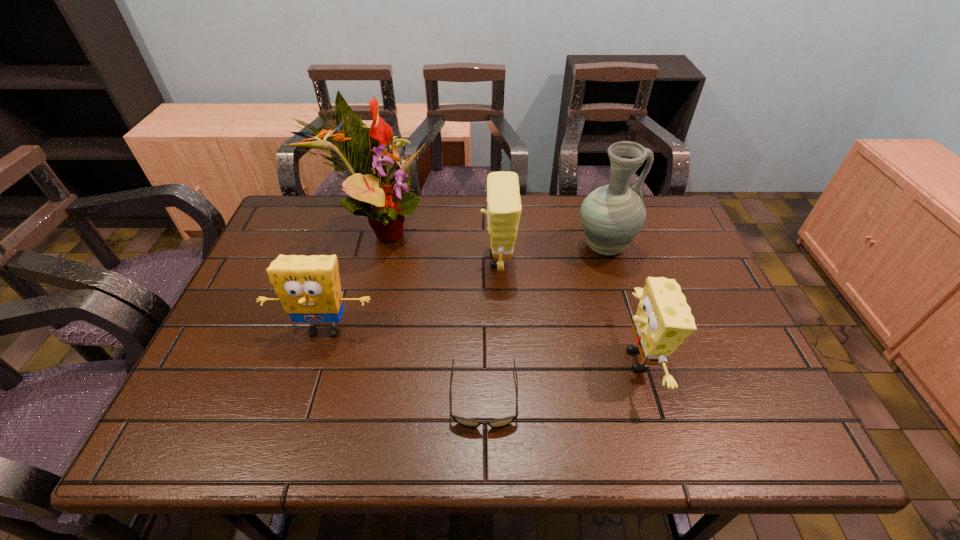
Find the location of `vacant space located on the face of the farthest sponge`. vacant space located on the face of the farthest sponge is located at coordinates (355, 260).

Identify the location of vacant space located 0.060m on the face of the leftmost sponge. The width and height of the screenshot is (960, 540). (312, 370).

The image size is (960, 540). I want to click on vacant area situated on the face of the rightmost sponge, so [x=553, y=360].

The height and width of the screenshot is (540, 960). Find the location of `vacant space located on the face of the rightmost sponge`. vacant space located on the face of the rightmost sponge is located at coordinates (488, 360).

Locate an element on the screen. free location located 0.110m on the face of the rightmost sponge is located at coordinates (570, 360).

I want to click on bouquet present at the far edge, so click(x=367, y=153).

Where is `pitcher present at the far edge`? The width and height of the screenshot is (960, 540). pitcher present at the far edge is located at coordinates (612, 215).

Identify the location of sponge that is at the far edge. The height and width of the screenshot is (540, 960). (504, 207).

In order to click on sponge present at the near edge in this screenshot , I will do `click(663, 320)`.

Identify the location of sunglasses at the near edge. The image size is (960, 540). (467, 422).